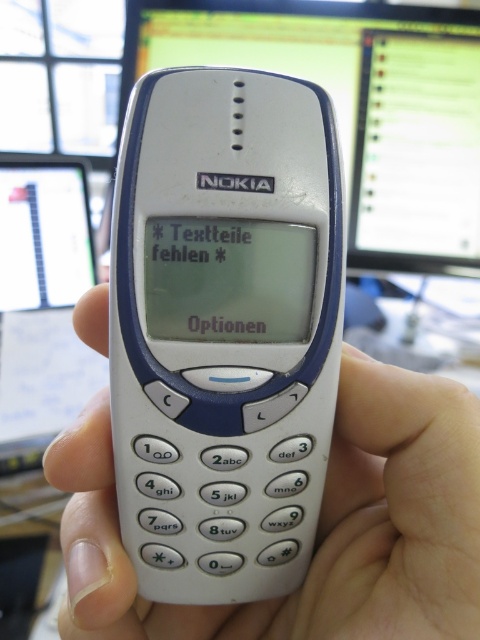
Question: Which object is farther from the camera taking this photo?

Choices:
 (A) matte plastic computer screen at upper center
 (B) white plastic phone at center

Answer: (A)

Question: Which point appears closest to the camera in this image?

Choices:
 (A) (228, 48)
 (B) (396, 609)
 (C) (324, 237)

Answer: (B)

Question: Which is nearer to the white plastic nokia phone at center?

Choices:
 (A) white plastic phone at center
 (B) matte plastic computer screen at upper center

Answer: (A)

Question: Can you confirm if white plastic nokia phone at center is wider than matte plastic computer screen at upper center?

Choices:
 (A) no
 (B) yes

Answer: (A)

Question: Is white plastic nokia phone at center smaller than white plastic phone at center?

Choices:
 (A) no
 (B) yes

Answer: (B)

Question: Where is white plastic nokia phone at center located in relation to white plastic phone at center in the image?

Choices:
 (A) below
 (B) above

Answer: (B)